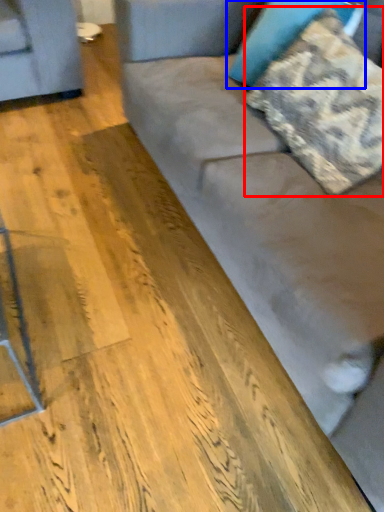
Question: Which of the following is the farthest to the observer, pillow (highlighted by a red box) or pillow (highlighted by a blue box)?

Choices:
 (A) pillow
 (B) pillow

Answer: (B)